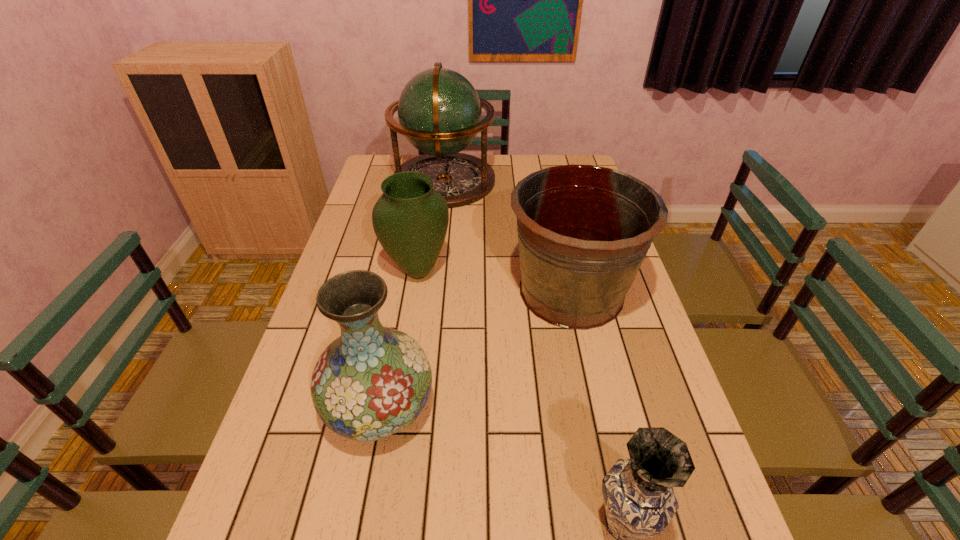
Where is `object situated at the far edge`? The width and height of the screenshot is (960, 540). object situated at the far edge is located at coordinates pyautogui.click(x=439, y=111).

The width and height of the screenshot is (960, 540). Find the location of `globe present at the left edge`. globe present at the left edge is located at coordinates (439, 111).

This screenshot has height=540, width=960. In order to click on object at the right edge in this screenshot , I will do `click(583, 231)`.

Locate an element on the screen. object at the far left corner is located at coordinates (439, 111).

I want to click on vacant region at the far edge of the desktop, so click(x=525, y=167).

The height and width of the screenshot is (540, 960). I want to click on free region at the left edge, so click(x=310, y=385).

The width and height of the screenshot is (960, 540). Find the location of `vacant region at the right edge`. vacant region at the right edge is located at coordinates (639, 411).

This screenshot has width=960, height=540. Identify the location of blank region between the globe and the second nearest object. (412, 293).

The height and width of the screenshot is (540, 960). Find the location of `free space between the bucket and the globe`. free space between the bucket and the globe is located at coordinates (508, 236).

Identify the location of free spot between the tallest vase and the bucket. This screenshot has height=540, width=960. (475, 348).